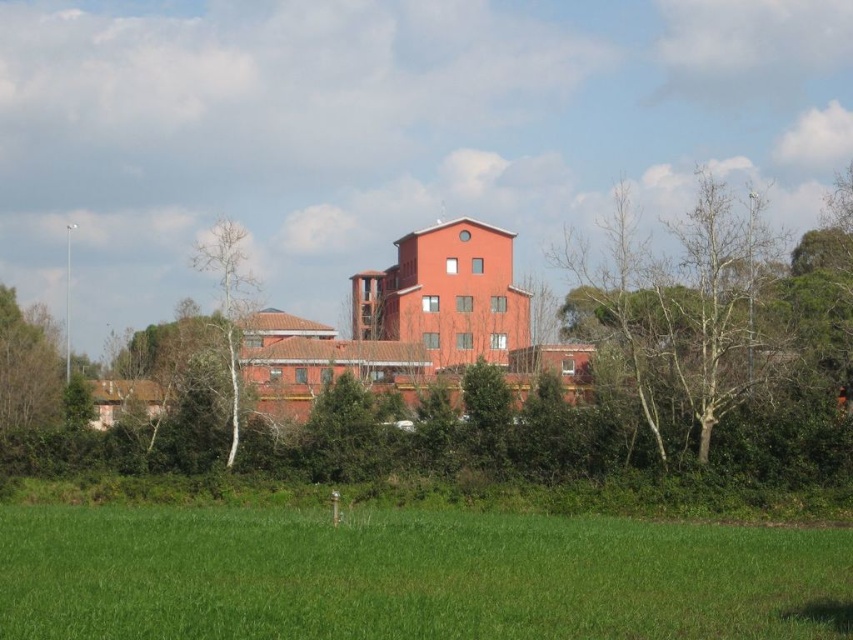
Question: Is green grass at lower center bigger than bare wood tree at left?

Choices:
 (A) yes
 (B) no

Answer: (B)

Question: Among these points, which one is farthest from the camera?

Choices:
 (A) (229, 372)
 (B) (438, 593)

Answer: (A)

Question: Does green grass at lower center have a lesser width compared to bare wood tree at left?

Choices:
 (A) yes
 (B) no

Answer: (B)

Question: Which object appears farthest from the camera in this image?

Choices:
 (A) bare wood tree at left
 (B) green grass at lower center

Answer: (A)

Question: Does green grass at lower center appear on the left side of bare wood tree at left?

Choices:
 (A) no
 (B) yes

Answer: (A)

Question: Among these points, which one is farthest from the camera?

Choices:
 (A) (247, 280)
 (B) (625, 611)

Answer: (A)